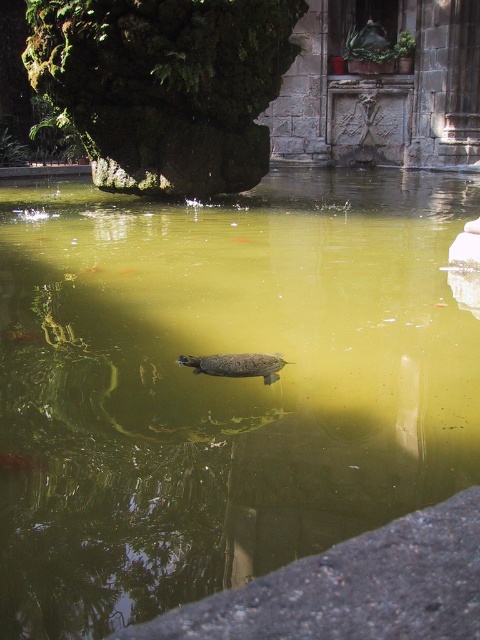
Who is more forward, (x=163, y=396) or (x=264, y=355)?

Point (x=163, y=396) is more forward.

Does green murky water at center appear over smooth brown tortoise at center?

Yes, green murky water at center is above smooth brown tortoise at center.

Between point (140, 221) and point (232, 364), which one is positioned behind?

The point (140, 221) is more distant.

The height and width of the screenshot is (640, 480). What are the coordinates of `green murky water at center` in the screenshot? It's located at (220, 385).